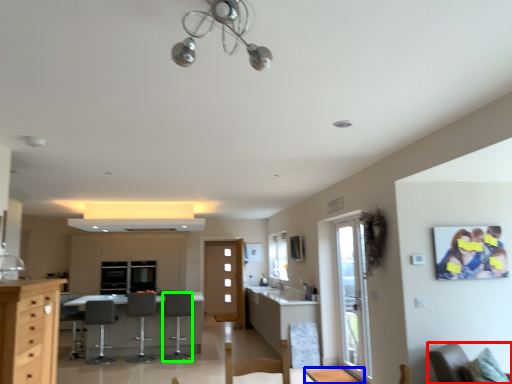
Question: Considering the real-world distances, which object is farthest from chair (highlighted by a red box)? table (highlighted by a blue box) or armchair (highlighted by a green box)?

Choices:
 (A) table
 (B) armchair

Answer: (B)